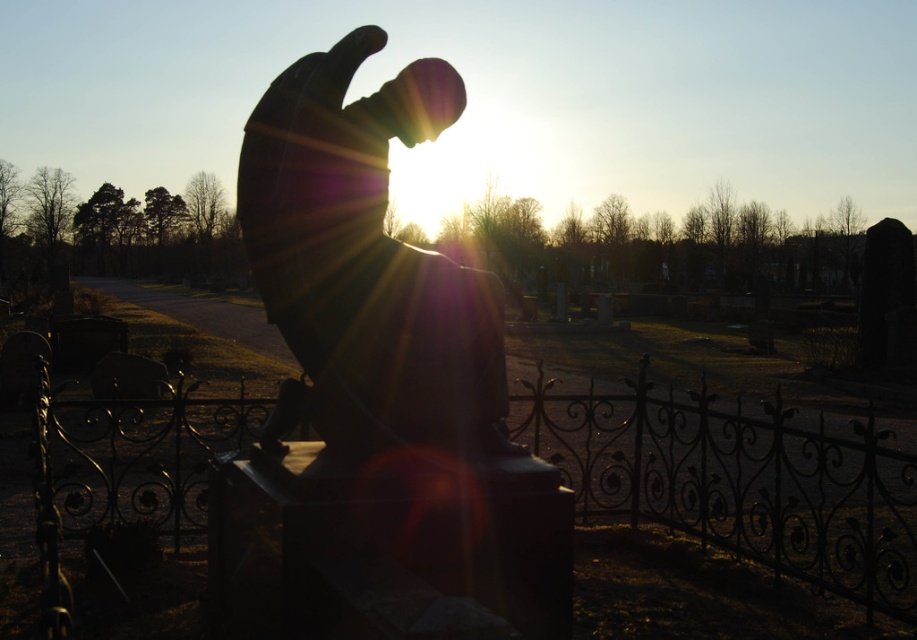
Question: Which of the following is the closest to the observer?

Choices:
 (A) (432, 616)
 (B) (829, 548)

Answer: (A)

Question: Can you confirm if sculpted stone figure at center is wider than black wrought iron fence at center?

Choices:
 (A) no
 (B) yes

Answer: (A)

Question: Is sculpted stone figure at center smaller than black wrought iron fence at center?

Choices:
 (A) yes
 (B) no

Answer: (A)

Question: Is sculpted stone figure at center to the right of black wrought iron fence at center from the viewer's perspective?

Choices:
 (A) yes
 (B) no

Answer: (B)

Question: Among these points, which one is farthest from the camera?

Choices:
 (A) (474, 310)
 (B) (708, 538)

Answer: (B)